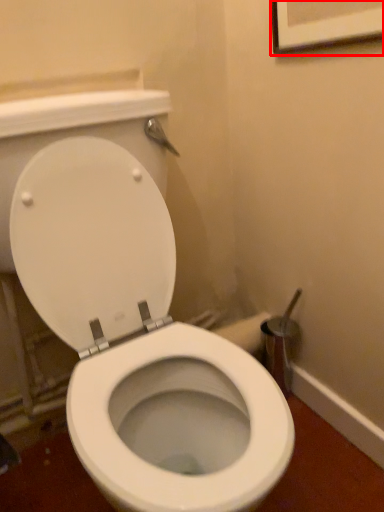
Question: From the image's perspective, what is the correct spatial relationship of picture frame (annotated by the red box) in relation to toilet?

Choices:
 (A) below
 (B) above

Answer: (B)